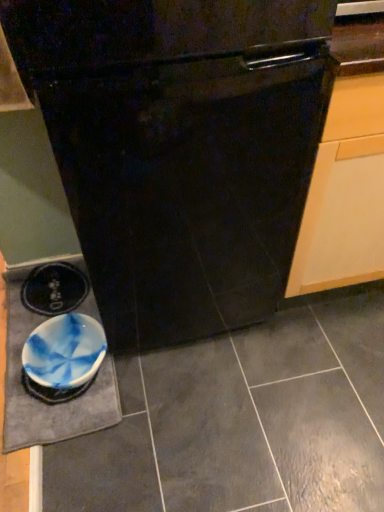
Question: Is black glossy oven at center taller than blue marbled bowl at lower left?

Choices:
 (A) yes
 (B) no

Answer: (A)

Question: Can you confirm if black glossy oven at center is bigger than blue marbled bowl at lower left?

Choices:
 (A) no
 (B) yes

Answer: (B)

Question: Is black glossy oven at center thinner than blue marbled bowl at lower left?

Choices:
 (A) no
 (B) yes

Answer: (A)

Question: Would you say black glossy oven at center contains blue marbled bowl at lower left?

Choices:
 (A) yes
 (B) no

Answer: (B)

Question: Does black glossy oven at center turn towards blue marbled bowl at lower left?

Choices:
 (A) no
 (B) yes

Answer: (A)

Question: From their relative heights in the image, would you say blue marbled slate at lower left is taller or shorter than black glossy oven at center?

Choices:
 (A) tall
 (B) short

Answer: (B)

Question: Does point (8, 326) appear closer or farther from the camera than point (119, 229)?

Choices:
 (A) closer
 (B) farther

Answer: (B)

Question: Is blue marbled slate at lower left in front of or behind black glossy oven at center in the image?

Choices:
 (A) behind
 (B) front

Answer: (A)

Question: In terms of width, does blue marbled slate at lower left look wider or thinner when compared to black glossy oven at center?

Choices:
 (A) wide
 (B) thin

Answer: (B)

Question: Is blue marbled slate at lower left taller or shorter than blue marbled bowl at lower left?

Choices:
 (A) short
 (B) tall

Answer: (A)

Question: Based on their positions, is blue marbled slate at lower left located to the left or right of blue marbled bowl at lower left?

Choices:
 (A) right
 (B) left

Answer: (B)

Question: From the image's perspective, relative to blue marbled bowl at lower left, is blue marbled slate at lower left above or below?

Choices:
 (A) above
 (B) below

Answer: (A)

Question: Does point (3, 448) appear closer or farther from the camera than point (56, 355)?

Choices:
 (A) farther
 (B) closer

Answer: (B)

Question: From a real-world perspective, relative to black glossy oven at center, is blue marbled bowl at lower left vertically above or below?

Choices:
 (A) above
 (B) below

Answer: (B)

Question: Is blue marbled bowl at lower left wider or thinner than black glossy oven at center?

Choices:
 (A) thin
 (B) wide

Answer: (A)